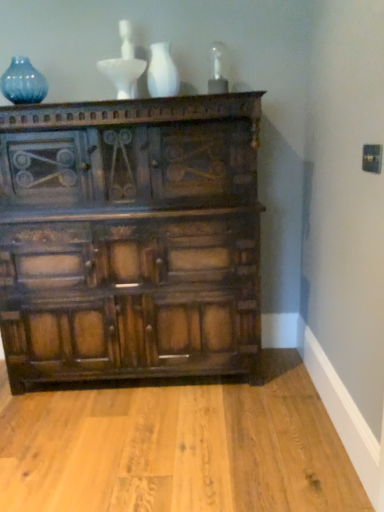
Question: From a real-world perspective, is blue glass vase at upper left above or below white glossy vase at upper center?

Choices:
 (A) above
 (B) below

Answer: (A)

Question: Looking at the image, does blue glass vase at upper left seem bigger or smaller compared to white glossy vase at upper center?

Choices:
 (A) big
 (B) small

Answer: (A)

Question: Considering the real-world distances, which object is farthest from the dark wood chest of drawers at center?

Choices:
 (A) blue glass vase at upper left
 (B) white glossy vase at upper center

Answer: (A)

Question: Based on their relative distances, which object is nearer to the white glossy vase at upper center?

Choices:
 (A) dark wood chest of drawers at center
 (B) blue glass vase at upper left

Answer: (B)